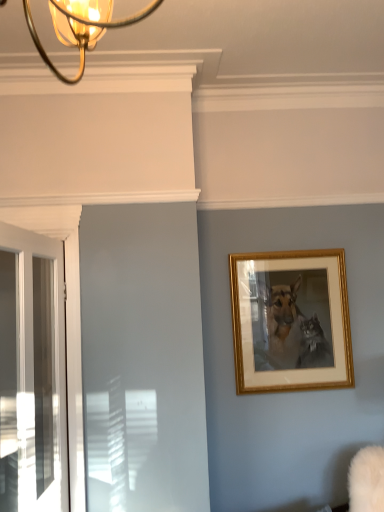
Question: Considering the relative sizes of gold/golden frame at upper right and white glossy door at left in the image provided, is gold/golden frame at upper right thinner than white glossy door at left?

Choices:
 (A) yes
 (B) no

Answer: (A)

Question: Considering the relative sizes of gold/golden frame at upper right and white glossy door at left in the image provided, is gold/golden frame at upper right smaller than white glossy door at left?

Choices:
 (A) yes
 (B) no

Answer: (A)

Question: From the image's perspective, is gold/golden frame at upper right over white glossy door at left?

Choices:
 (A) yes
 (B) no

Answer: (A)

Question: Considering the relative positions of gold/golden frame at upper right and white glossy door at left in the image provided, is gold/golden frame at upper right to the left of white glossy door at left from the viewer's perspective?

Choices:
 (A) no
 (B) yes

Answer: (A)

Question: Does gold/golden frame at upper right turn towards white glossy door at left?

Choices:
 (A) yes
 (B) no

Answer: (B)

Question: Can you confirm if gold/golden frame at upper right is shorter than white glossy door at left?

Choices:
 (A) yes
 (B) no

Answer: (A)

Question: Does white glossy door at left have a larger size compared to gold/golden frame at upper right?

Choices:
 (A) yes
 (B) no

Answer: (A)

Question: Can you confirm if white glossy door at left is smaller than gold/golden frame at upper right?

Choices:
 (A) no
 (B) yes

Answer: (A)

Question: Could you tell me if white glossy door at left is turned towards gold/golden frame at upper right?

Choices:
 (A) no
 (B) yes

Answer: (A)

Question: Does white glossy door at left touch gold/golden frame at upper right?

Choices:
 (A) yes
 (B) no

Answer: (B)

Question: Considering the relative positions of white glossy door at left and gold/golden frame at upper right in the image provided, is white glossy door at left to the left of gold/golden frame at upper right from the viewer's perspective?

Choices:
 (A) no
 (B) yes

Answer: (B)

Question: From a real-world perspective, is white glossy door at left beneath gold/golden frame at upper right?

Choices:
 (A) no
 (B) yes

Answer: (B)

Question: From the image's perspective, is gold/golden frame at upper right located above or below white glossy door at left?

Choices:
 (A) above
 (B) below

Answer: (A)